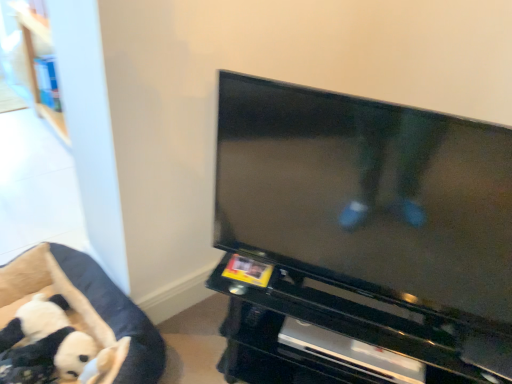
Question: Does black plush toy at lower left appear on the right side of black glossy tv at center?

Choices:
 (A) no
 (B) yes

Answer: (A)

Question: Is black plush toy at lower left oriented away from black glossy tv at center?

Choices:
 (A) no
 (B) yes

Answer: (A)

Question: Can black glossy tv at center be found inside black plush toy at lower left?

Choices:
 (A) no
 (B) yes

Answer: (A)

Question: Can you confirm if black plush toy at lower left is bigger than black glossy tv at center?

Choices:
 (A) yes
 (B) no

Answer: (B)

Question: Is black plush toy at lower left not inside black glossy tv at center?

Choices:
 (A) yes
 (B) no

Answer: (A)

Question: Considering their positions, is black glossy tv at center located in front of or behind black glossy entertainment center at center?

Choices:
 (A) behind
 (B) front

Answer: (B)

Question: Based on their sizes in the image, would you say black glossy tv at center is bigger or smaller than black glossy entertainment center at center?

Choices:
 (A) big
 (B) small

Answer: (B)

Question: From a real-world perspective, is black glossy tv at center physically located above or below black glossy entertainment center at center?

Choices:
 (A) below
 (B) above

Answer: (B)

Question: Does point (437, 165) appear closer or farther from the camera than point (449, 354)?

Choices:
 (A) farther
 (B) closer

Answer: (B)

Question: Considering the positions of point (324, 152) and point (33, 281), is point (324, 152) closer or farther from the camera than point (33, 281)?

Choices:
 (A) farther
 (B) closer

Answer: (B)

Question: From the image's perspective, is black glossy tv at center located above or below soft plush dog bed at lower left?

Choices:
 (A) above
 (B) below

Answer: (A)

Question: Considering the positions of black glossy tv at center and soft plush dog bed at lower left in the image, is black glossy tv at center bigger or smaller than soft plush dog bed at lower left?

Choices:
 (A) big
 (B) small

Answer: (B)

Question: Is black glossy tv at center taller or shorter than soft plush dog bed at lower left?

Choices:
 (A) tall
 (B) short

Answer: (A)

Question: Is point (89, 349) positioned closer to the camera than point (268, 349)?

Choices:
 (A) farther
 (B) closer

Answer: (A)

Question: From the image's perspective, is black plush toy at lower left positioned above or below black glossy entertainment center at center?

Choices:
 (A) above
 (B) below

Answer: (B)